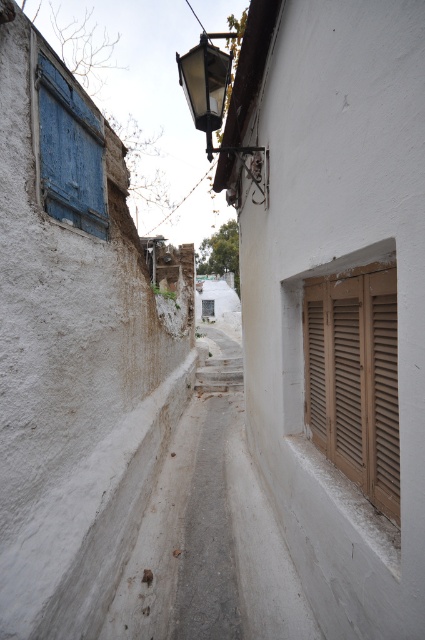
Question: Is brown wooden shutters at right further to camera compared to blue painted wood at left?

Choices:
 (A) yes
 (B) no

Answer: (B)

Question: Does brown wooden shutters at right have a greater width compared to matte black lamp at upper center?

Choices:
 (A) no
 (B) yes

Answer: (A)

Question: Which object is the farthest from the brown wooden shutters at right?

Choices:
 (A) blue painted wood at left
 (B) matte black lamp at upper center

Answer: (A)

Question: Is blue painted wood at left positioned at the back of matte black lamp at upper center?

Choices:
 (A) no
 (B) yes

Answer: (A)

Question: Which object is positioned closest to the brown wooden shutters at right?

Choices:
 (A) matte black lamp at upper center
 (B) blue painted wood at left

Answer: (A)

Question: Based on their relative distances, which object is farther from the blue painted wood at left?

Choices:
 (A) matte black lamp at upper center
 (B) brown wooden shutters at right

Answer: (B)